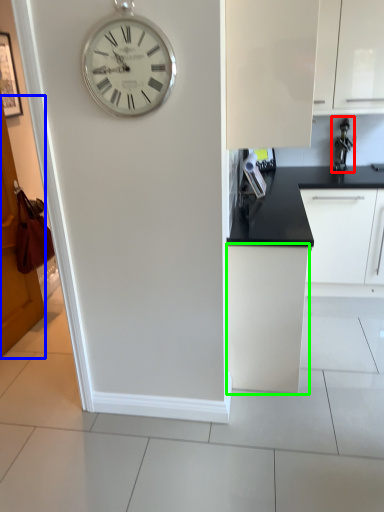
Question: Estimate the real-world distances between objects in this image. Which object is closer to appliance (highlighted by a red box), door (highlighted by a blue box) or cabinetry (highlighted by a green box)?

Choices:
 (A) door
 (B) cabinetry

Answer: (B)